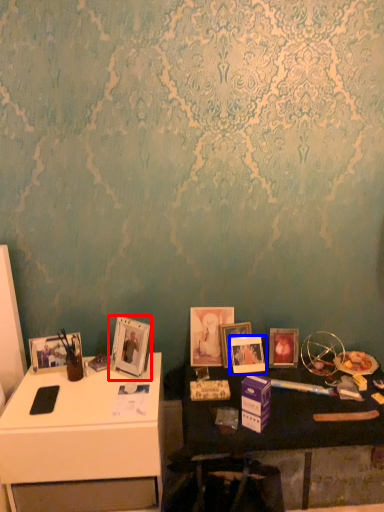
Question: Among these objects, which one is farthest to the camera, picture frame (highlighted by a red box) or picture frame (highlighted by a blue box)?

Choices:
 (A) picture frame
 (B) picture frame

Answer: (B)